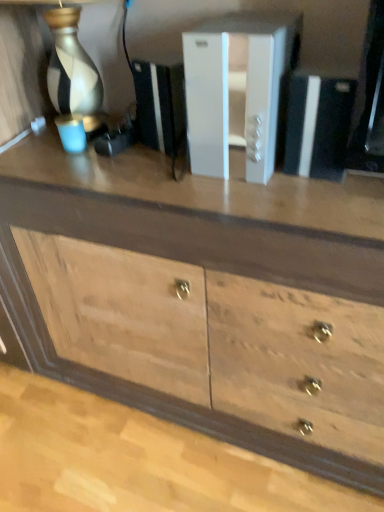
I want to click on free space in front of white plastic file cabinet at center, so click(x=283, y=208).